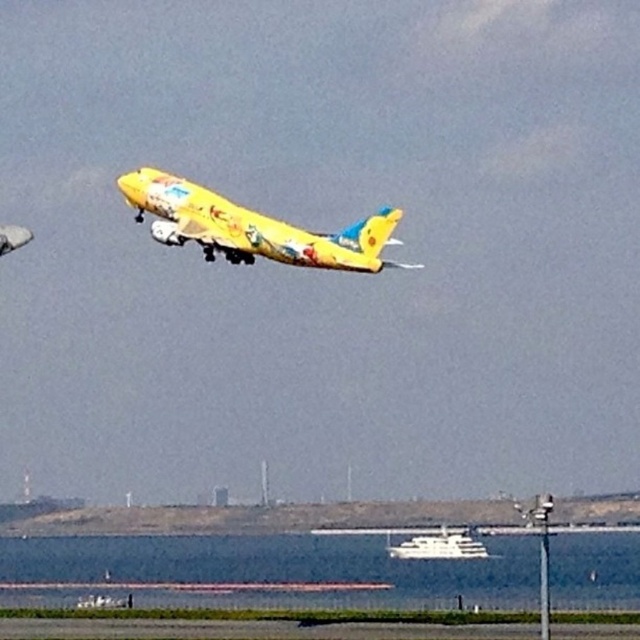
Can you confirm if yellow matte airplane at center is thinner than white glossy boat at lower center?

Incorrect, yellow matte airplane at center's width is not less than white glossy boat at lower center's.

Is point (240, 230) positioned in front of point (403, 554)?

Yes, it is in front of point (403, 554).

The height and width of the screenshot is (640, 640). I want to click on yellow matte airplane at center, so click(252, 227).

Is transparent water at lower center bigger than white glossy boat at lower center?

Yes.

The image size is (640, 640). I want to click on transparent water at lower center, so click(280, 568).

Image resolution: width=640 pixels, height=640 pixels. What are the coordinates of `transparent water at lower center` in the screenshot? It's located at [x=280, y=568].

Does transparent water at lower center have a greater width compared to yellow matte airplane at center?

Yes, transparent water at lower center is wider than yellow matte airplane at center.

Can you confirm if transparent water at lower center is positioned below yellow matte airplane at center?

Yes.

Based on the photo, who is more forward, (266,548) or (154,230)?

Positioned in front is point (154,230).

Where is `transparent water at lower center`? The width and height of the screenshot is (640, 640). transparent water at lower center is located at coordinates (280, 568).